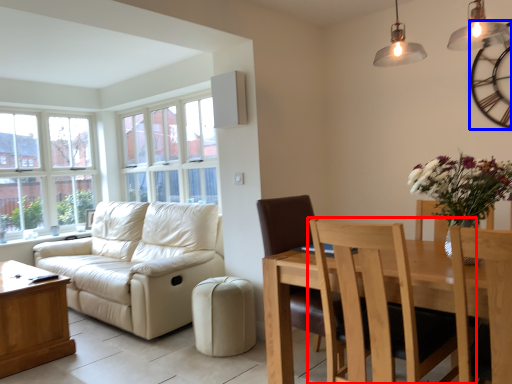
Question: Which point is further to the camera, chair (highlighted by a red box) or clock (highlighted by a blue box)?

Choices:
 (A) chair
 (B) clock

Answer: (B)